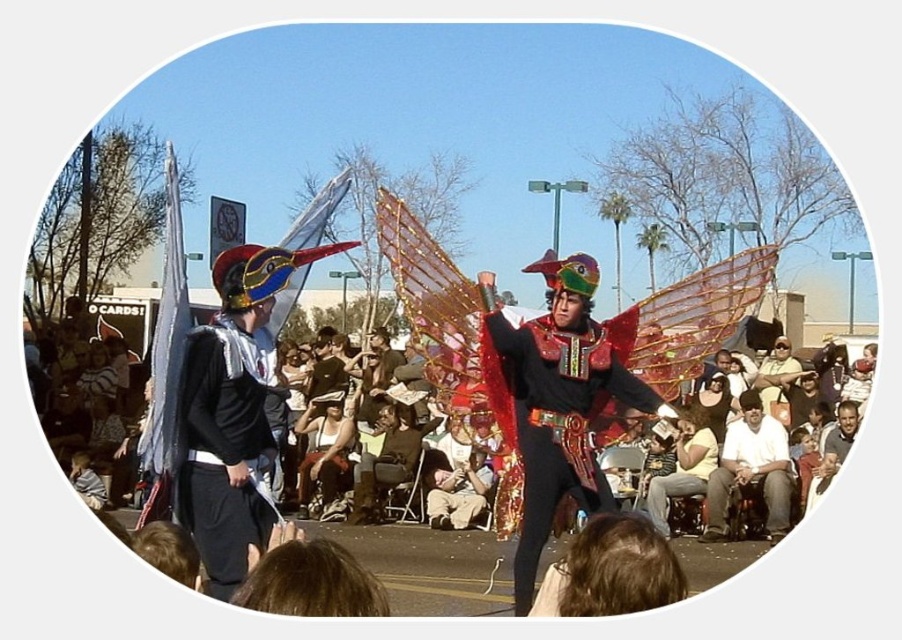
In the scene shown: You are a photographer at the festival and want to capture a photo of both the shiny metallic wings at center and the white cotton shirt at lower right in the same frame. Based on their positions, which object should you focus on first to ensure both are in the frame?

The shiny metallic wings at center is to the left of white cotton shirt at lower right, so you should focus on the shiny metallic wings at center first to ensure both are in the frame.

You are a photographer at the festival and want to capture a photo where the shiny metallic wings at center and the matte black cape at center are both visible. Given their positions, which object should you focus on first to ensure both are in frame?

The shiny metallic wings at center is below the matte black cape at center, so you should focus on the matte black cape at center first to ensure both are in frame.

You are a photographer trying to capture the shiny metallic wings at center and the white cotton shirt at lower right in the same frame. Which object should you focus on first if you want to ensure both are in focus, considering their sizes?

The shiny metallic wings at center is larger in size than the white cotton shirt at lower right, so you should focus on the shiny metallic wings at center first to ensure both are in focus.